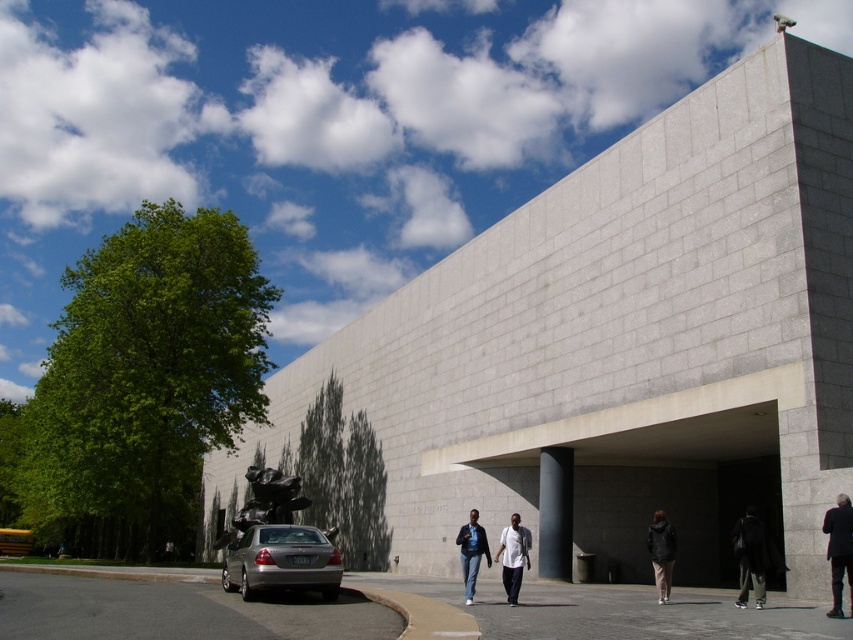
Can you confirm if dark gray suit at lower right is positioned to the right of dark gray jacket at lower right?

Yes, dark gray suit at lower right is to the right of dark gray jacket at lower right.

The height and width of the screenshot is (640, 853). Find the location of `dark gray suit at lower right`. dark gray suit at lower right is located at coordinates (839, 548).

Can you confirm if silver metallic sedan at lower left is thinner than dark gray jacket at lower right?

Correct, silver metallic sedan at lower left's width is less than dark gray jacket at lower right's.

Can you confirm if silver metallic sedan at lower left is taller than dark gray jacket at lower right?

No.

Does point (242, 588) come in front of point (659, 598)?

Yes, it is.

Where is `silver metallic sedan at lower left`? silver metallic sedan at lower left is located at coordinates point(282,561).

Between point (254, 573) and point (757, 552), which one is positioned in front?

Point (757, 552) is in front.

Locate an element on the screen. Image resolution: width=853 pixels, height=640 pixels. silver metallic sedan at lower left is located at coordinates (282, 561).

Is point (294, 560) less distant than point (749, 508)?

No.

You are a GUI agent. You are given a task and a screenshot of the screen. Output one action in this format:
    pyautogui.click(x=<x>, y=<y>)
    Task: Click on the silver metallic sedan at lower left
    The image size is (853, 640).
    Given the screenshot: What is the action you would take?
    pyautogui.click(x=282, y=561)